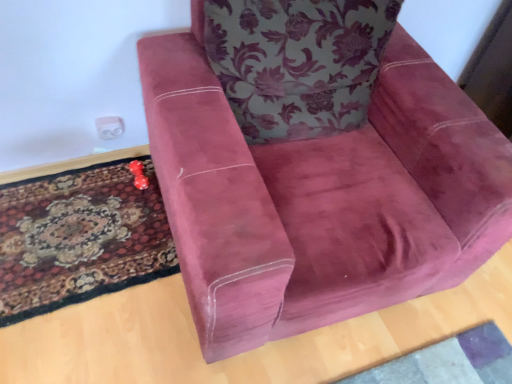
Question: Would you say carpeted rug at lower left is to the left or to the right of velvet maroon armchair at center in the picture?

Choices:
 (A) right
 (B) left

Answer: (B)

Question: From a real-world perspective, is carpeted rug at lower left physically located above or below velvet maroon armchair at center?

Choices:
 (A) above
 (B) below

Answer: (B)

Question: Estimate the real-world distances between objects in this image. Which object is closer to the floral fabric cushion at upper center?

Choices:
 (A) carpeted rug at lower left
 (B) rubberized red dice at lower left
 (C) velvet maroon armchair at center

Answer: (C)

Question: Which is nearer to the rubberized red dice at lower left?

Choices:
 (A) carpeted rug at lower left
 (B) velvet maroon armchair at center
 (C) floral fabric cushion at upper center

Answer: (A)